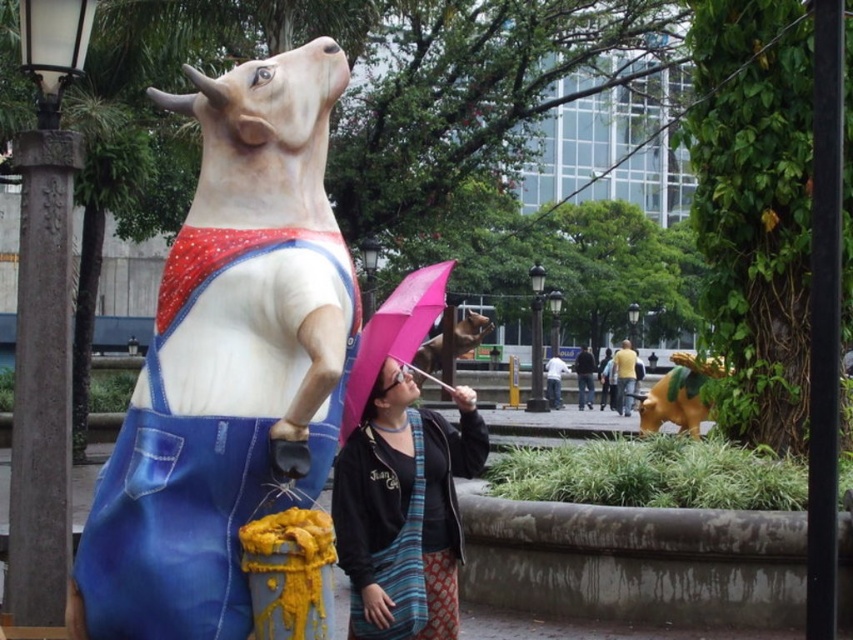
Is point (236, 77) farther from camera compared to point (628, 403)?

That is False.

Which is behind, point (200, 340) or point (630, 390)?

The point (630, 390) is behind.

Where is `white glossy statue at upper left`? This screenshot has width=853, height=640. white glossy statue at upper left is located at coordinates (227, 362).

Find the location of `white glossy statue at upper left`. white glossy statue at upper left is located at coordinates (227, 362).

Can you confirm if blue striped apron at center is positioned to the right of dark blue jeans at center?

No, blue striped apron at center is not to the right of dark blue jeans at center.

Does blue striped apron at center have a lesser height compared to dark blue jeans at center?

Yes.

Is point (402, 572) in front of point (585, 368)?

Yes, it is.

This screenshot has width=853, height=640. Identify the location of blue striped apron at center. (399, 563).

Is stone lamp post at left positioned before shiny brown dog at center?

No, stone lamp post at left is behind shiny brown dog at center.

Find the location of a particular element. Image resolution: width=853 pixels, height=640 pixels. stone lamp post at left is located at coordinates (44, 316).

Is point (18, 476) more distant than point (413, 364)?

No.

The image size is (853, 640). Find the location of `stone lamp post at left`. stone lamp post at left is located at coordinates (44, 316).